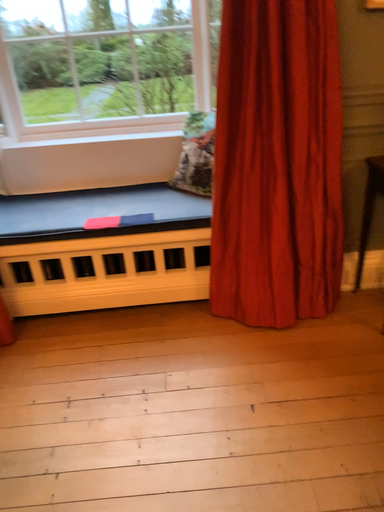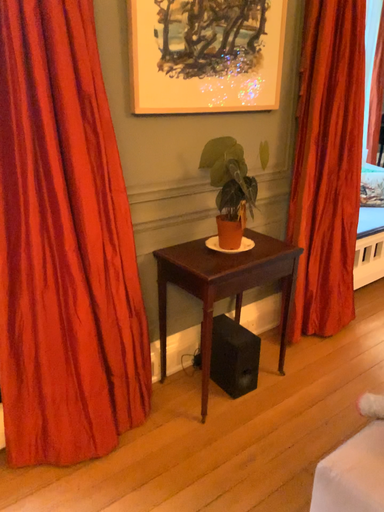
Question: Which way did the camera rotate in the video?

Choices:
 (A) rotated right
 (B) rotated left

Answer: (A)